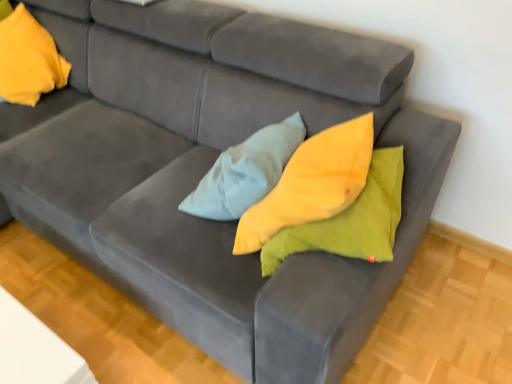
You are a GUI agent. You are given a task and a screenshot of the screen. Output one action in this format:
    pyautogui.click(x=<x>, y=<y>)
    Task: Click on the yellow fabric pillow at upper left
    
    Given the screenshot: What is the action you would take?
    pyautogui.click(x=28, y=59)

The width and height of the screenshot is (512, 384). What do you see at coordinates (28, 59) in the screenshot?
I see `yellow fabric pillow at upper left` at bounding box center [28, 59].

Image resolution: width=512 pixels, height=384 pixels. Find the location of `yellow fabric pillow at upper left`. yellow fabric pillow at upper left is located at coordinates coord(28,59).